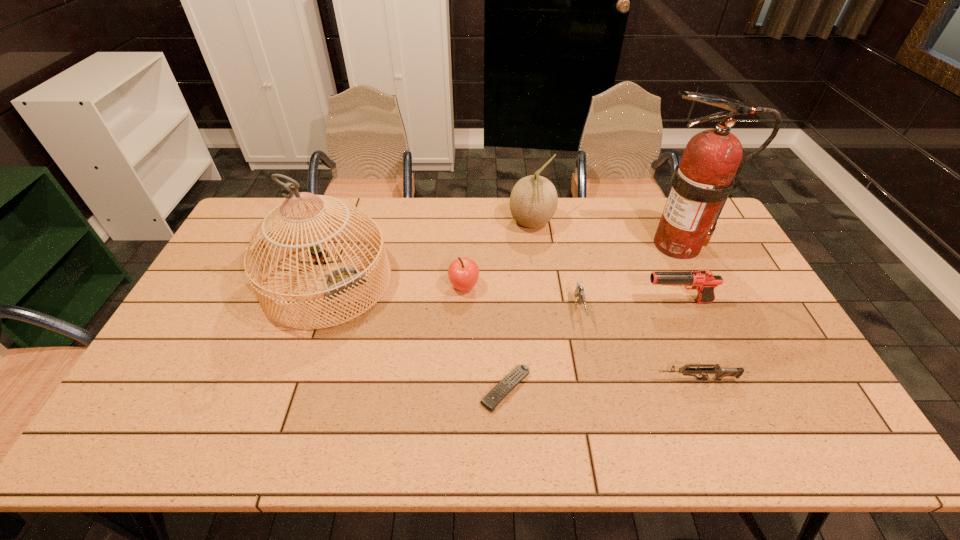
Locate an element on the screen. free region located aimed along the barrel of the shortest gun is located at coordinates (562, 380).

At what (x,y) coordinates should I click in order to perform the action: click on vacant area located 0.310m aimed along the barrel of the shortest gun. Please return your answer as a coordinate pair (x, y). Looking at the image, I should click on (534, 380).

Locate an element on the screen. This screenshot has width=960, height=540. vacant space located aimed along the barrel of the shortest gun is located at coordinates (624, 380).

In order to click on vacant space located on the right of the shortest object in this screenshot , I will do `click(594, 389)`.

Identify the location of fire extinguisher at the far edge. This screenshot has height=540, width=960. (709, 169).

Image resolution: width=960 pixels, height=540 pixels. In order to click on birdcage positioned at the far edge in this screenshot , I will do `click(335, 281)`.

The width and height of the screenshot is (960, 540). What are the coordinates of `cantaloup that is at the far edge` in the screenshot? It's located at (533, 201).

Where is `fire extinguisher that is at the right edge`? The width and height of the screenshot is (960, 540). fire extinguisher that is at the right edge is located at coordinates (709, 169).

You are a GUI agent. You are given a task and a screenshot of the screen. Output one action in this format:
    pyautogui.click(x=<x>, y=<y>)
    Task: Click on the gun positioned at the right edge
    This screenshot has width=960, height=540.
    Given the screenshot: What is the action you would take?
    pyautogui.click(x=703, y=281)

Locate an element on the screen. object that is at the far right corner is located at coordinates (709, 169).